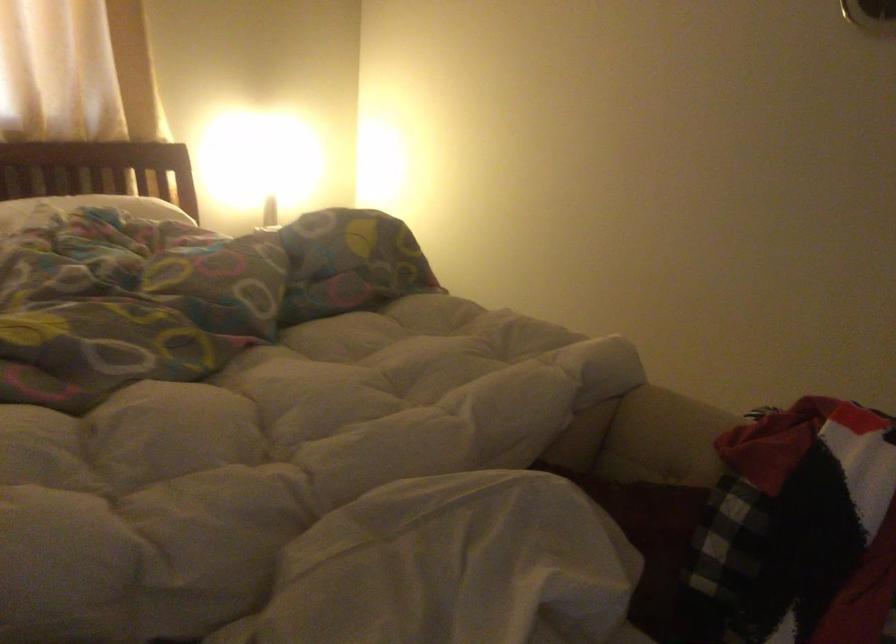
Where would you lift the white pillow? Please return your answer as a coordinate pair (x, y).

(90, 207)